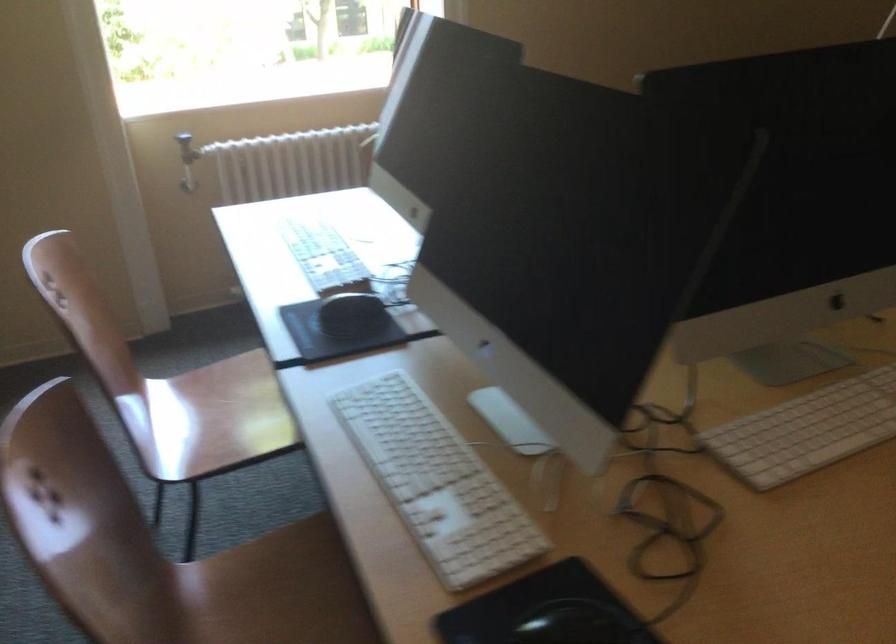
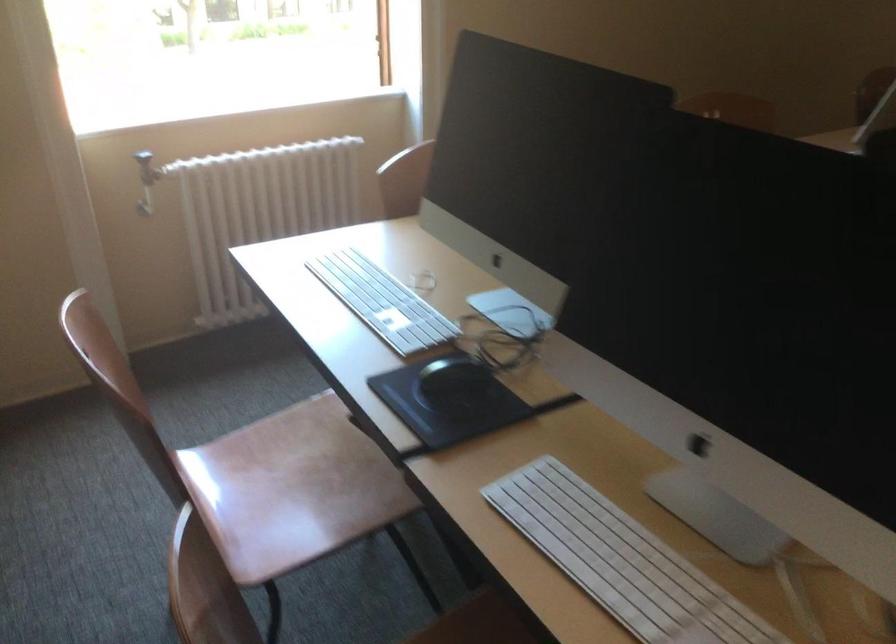
Find the pixel in the second image that matches [340,308] in the first image.

(452, 383)